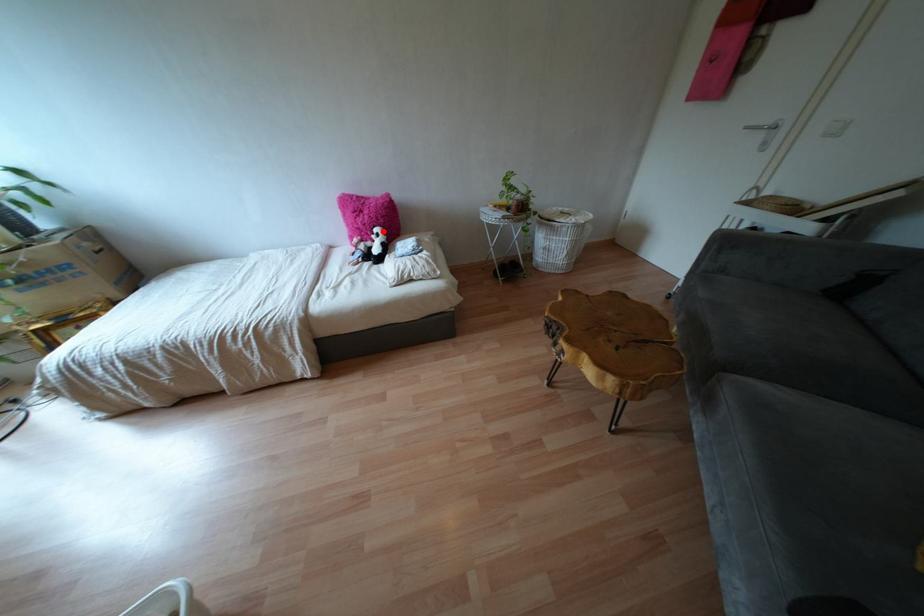
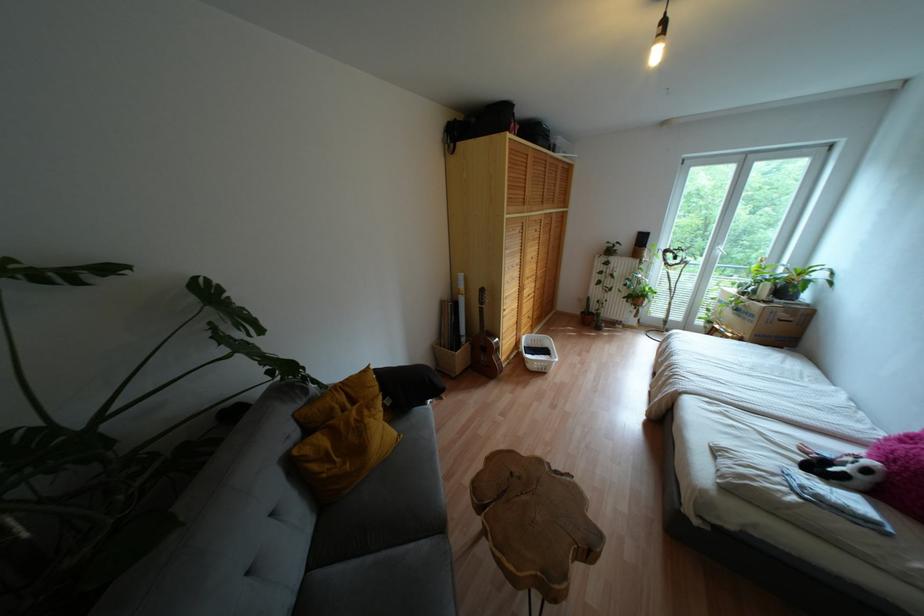
Question: I am providing you with two images of the same scene from different viewpoints. Given a red point in image1, look at the same physical point in image2. Is it:

Choices:
 (A) Closer to the viewpoint
 (B) Farther from the viewpoint

Answer: (B)